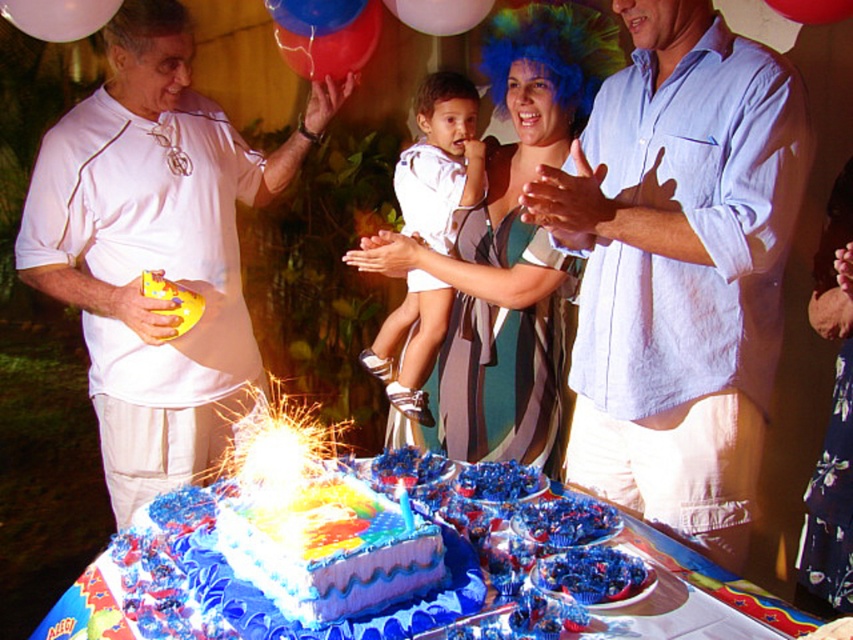
Question: Which object is positioned closest to the matte white balloon at upper left?

Choices:
 (A) rubber balloon at upper center
 (B) blue rubber balloon at upper center
 (C) striped dress at center
 (D) blue glossy birthday candle at center

Answer: (B)

Question: Does striped dress at center have a smaller size compared to shiny plastic balloon at upper center?

Choices:
 (A) no
 (B) yes

Answer: (B)

Question: Is white satin dress at center further to camera compared to blue glossy birthday candle at center?

Choices:
 (A) yes
 (B) no

Answer: (A)

Question: Can you confirm if matte white balloon at upper left is wider than rubberized red balloon at upper center?

Choices:
 (A) yes
 (B) no

Answer: (A)

Question: Which point is farther to the camera?

Choices:
 (A) rubber balloon at upper center
 (B) white matte shirt at left
 (C) blue rubber balloon at upper center
 (D) shiny blue cake at center

Answer: (C)

Question: Which point appears closest to the camera in this image?

Choices:
 (A) (392, 504)
 (B) (397, 493)
 (C) (786, 0)

Answer: (A)